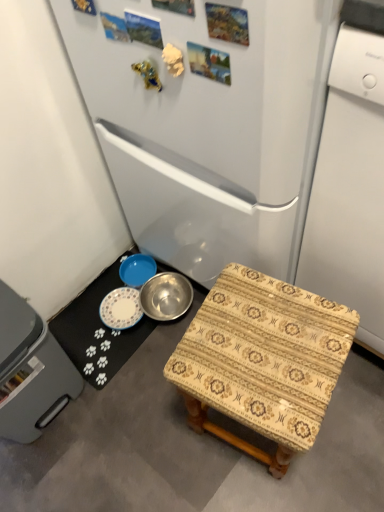
Find the location of a particular element. free space in front of gray plastic dishwasher at lower left is located at coordinates (61, 475).